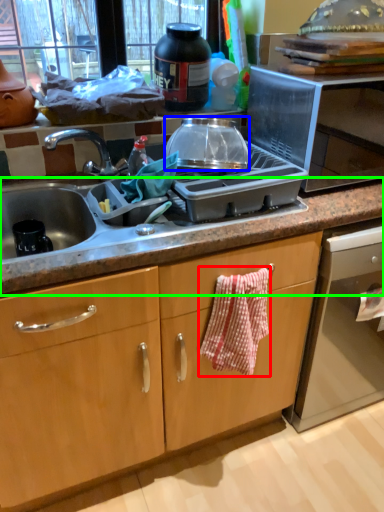
Question: Estimate the real-world distances between objects in this image. Which object is farther from hand towel (highlighted by a red box), kitchen appliance (highlighted by a blue box) or countertop (highlighted by a green box)?

Choices:
 (A) kitchen appliance
 (B) countertop

Answer: (A)